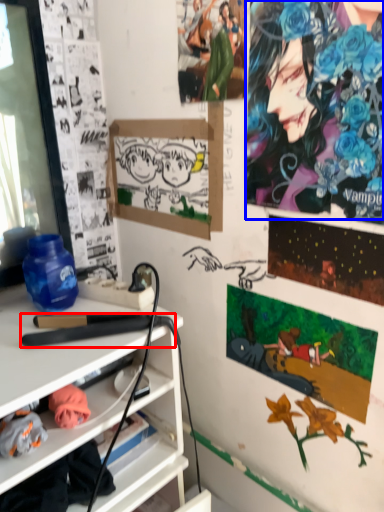
Question: Which object is further to the camera taking this photo, equipment (highlighted by a red box) or person (highlighted by a blue box)?

Choices:
 (A) equipment
 (B) person

Answer: (A)